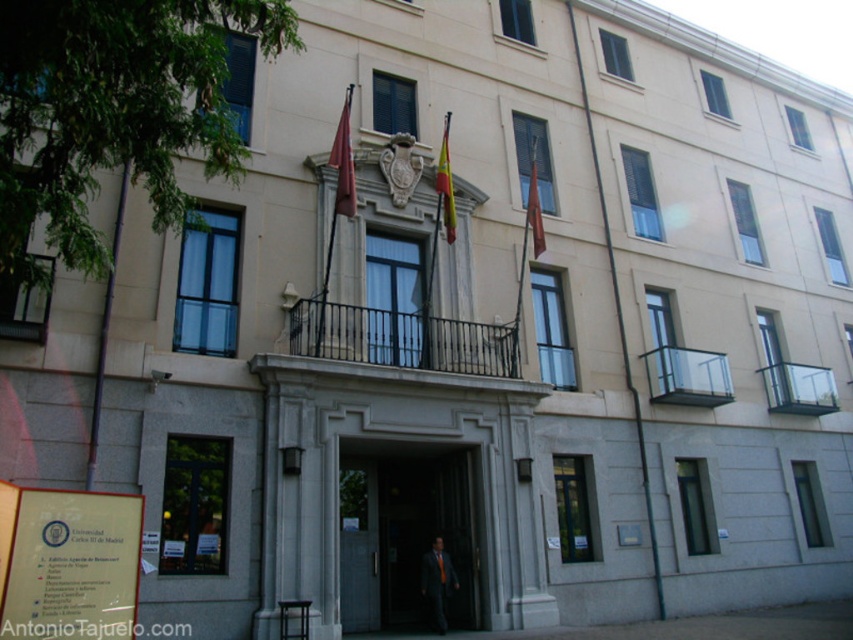
Does smooth gray door at center appear on the right side of matte red flag at upper center?

Correct, you'll find smooth gray door at center to the right of matte red flag at upper center.

Does point (432, 531) lie behind point (341, 208)?

Yes, it is behind point (341, 208).

Does point (456, 509) lie behind point (350, 154)?

That is True.

This screenshot has height=640, width=853. Find the location of `smooth gray door at center`. smooth gray door at center is located at coordinates (405, 534).

Is smooth gray door at center shorter than matte black suit at center?

No, smooth gray door at center is not shorter than matte black suit at center.

Find the location of `smooth gray door at center`. smooth gray door at center is located at coordinates (405, 534).

Does matte black suit at center have a lesser height compared to red fabric flag at upper center?

Yes.

Based on the photo, is matte black suit at center taller than red fabric flag at upper center?

Incorrect, matte black suit at center's height is not larger of red fabric flag at upper center's.

The image size is (853, 640). What do you see at coordinates (437, 580) in the screenshot? I see `matte black suit at center` at bounding box center [437, 580].

Find the location of `matte black suit at center`. matte black suit at center is located at coordinates (437, 580).